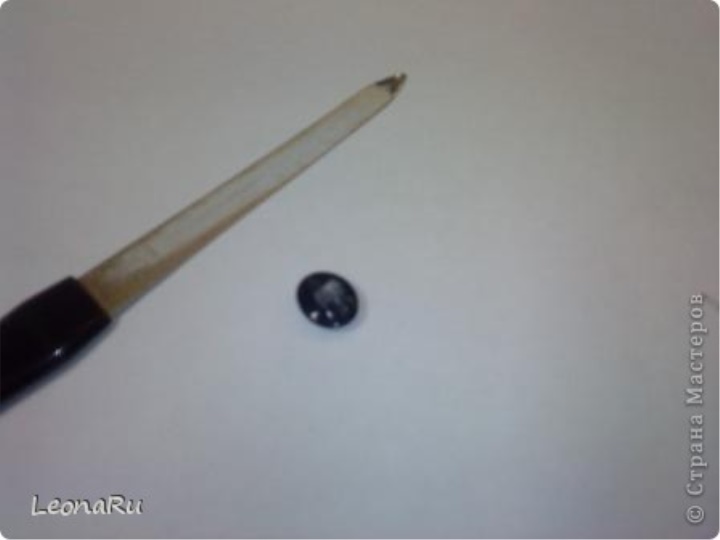
This screenshot has height=540, width=720. I want to click on table, so click(x=486, y=302).